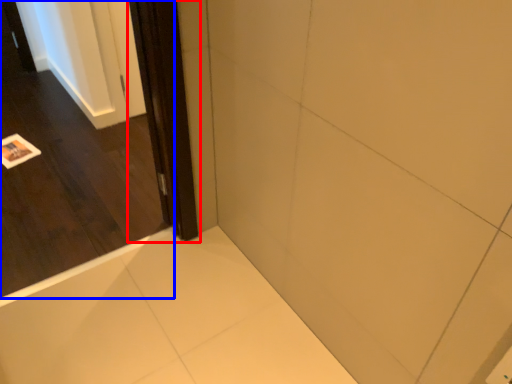
Question: Which object is closer to the camera taking this photo, screen door (highlighted by a red box) or door (highlighted by a blue box)?

Choices:
 (A) screen door
 (B) door

Answer: (B)